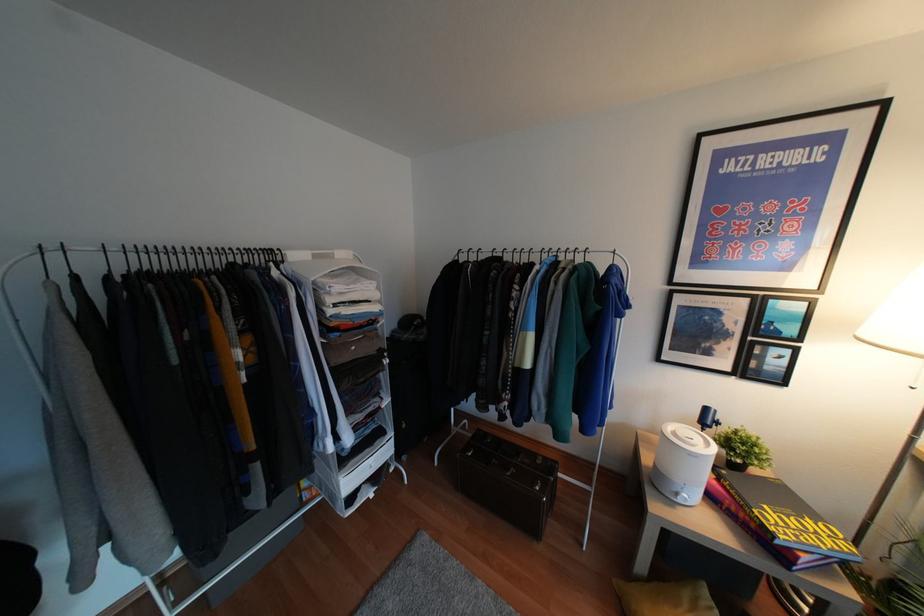
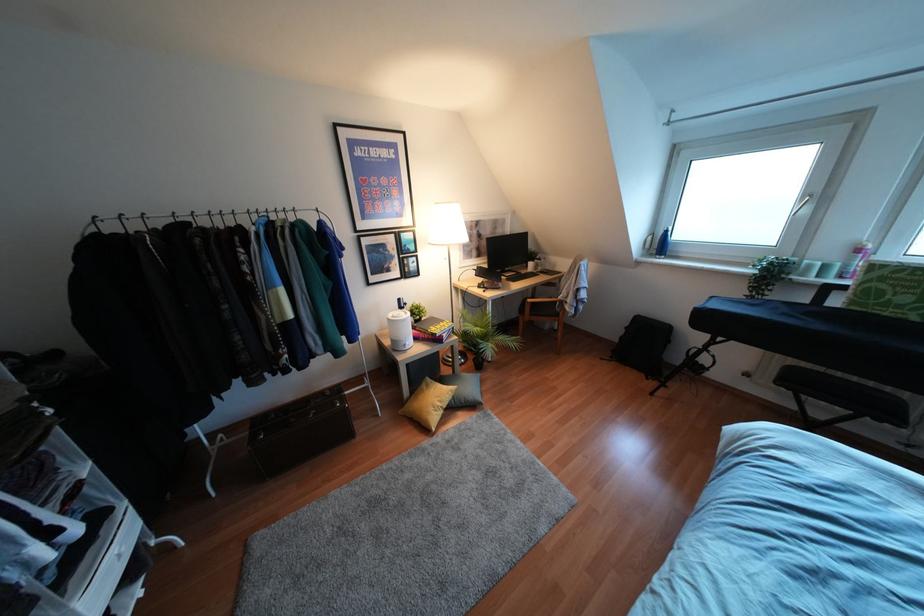
Where in the second image is the point corresponding to (x=678, y=500) from the first image?

(407, 347)